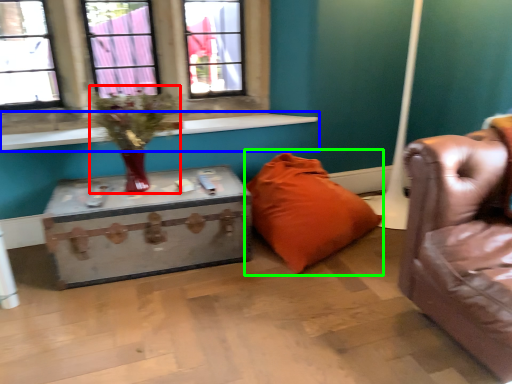
Question: Estimate the real-world distances between objects in this image. Which object is farther from floral arrangement (highlighted by a red box), window sill (highlighted by a blue box) or pillow (highlighted by a green box)?

Choices:
 (A) window sill
 (B) pillow

Answer: (B)